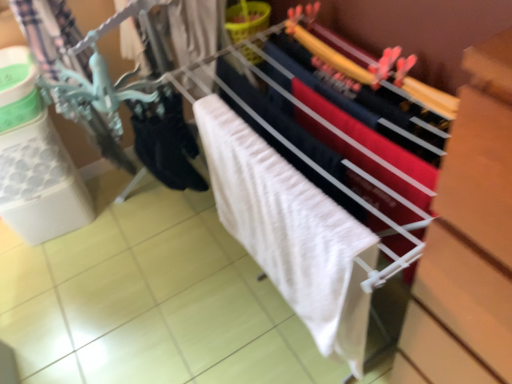
Question: Considering the relative sizes of white fabric at center and white textured bath towel at center in the image provided, is white fabric at center taller than white textured bath towel at center?

Choices:
 (A) no
 (B) yes

Answer: (B)

Question: Is white textured bath towel at center located within white fabric at center?

Choices:
 (A) no
 (B) yes

Answer: (B)

Question: Is white fabric at center positioned before white textured bath towel at center?

Choices:
 (A) no
 (B) yes

Answer: (B)

Question: Is white fabric at center directly adjacent to white textured bath towel at center?

Choices:
 (A) yes
 (B) no

Answer: (B)

Question: Is white fabric at center not within white textured bath towel at center?

Choices:
 (A) yes
 (B) no

Answer: (A)

Question: From the image's perspective, relative to white fabric at center, is black matte socks at lower left above or below?

Choices:
 (A) below
 (B) above

Answer: (B)

Question: Is point (154, 160) positioned closer to the camera than point (347, 125)?

Choices:
 (A) farther
 (B) closer

Answer: (A)

Question: From a real-world perspective, is black matte socks at lower left physically located above or below white fabric at center?

Choices:
 (A) below
 (B) above

Answer: (B)

Question: Is black matte socks at lower left in front of or behind white fabric at center in the image?

Choices:
 (A) front
 (B) behind

Answer: (B)

Question: From a real-world perspective, is white textured bath towel at center above or below black matte socks at lower left?

Choices:
 (A) above
 (B) below

Answer: (B)

Question: Is white textured bath towel at center situated inside black matte socks at lower left or outside?

Choices:
 (A) outside
 (B) inside

Answer: (A)

Question: Is white textured bath towel at center wider or thinner than black matte socks at lower left?

Choices:
 (A) thin
 (B) wide

Answer: (B)

Question: Visually, is white textured bath towel at center positioned to the left or to the right of black matte socks at lower left?

Choices:
 (A) right
 (B) left

Answer: (A)

Question: Looking at the image, does white fabric at center seem bigger or smaller compared to white textured bath towel at center?

Choices:
 (A) big
 (B) small

Answer: (A)

Question: From the image's perspective, is white fabric at center above or below white textured bath towel at center?

Choices:
 (A) above
 (B) below

Answer: (A)